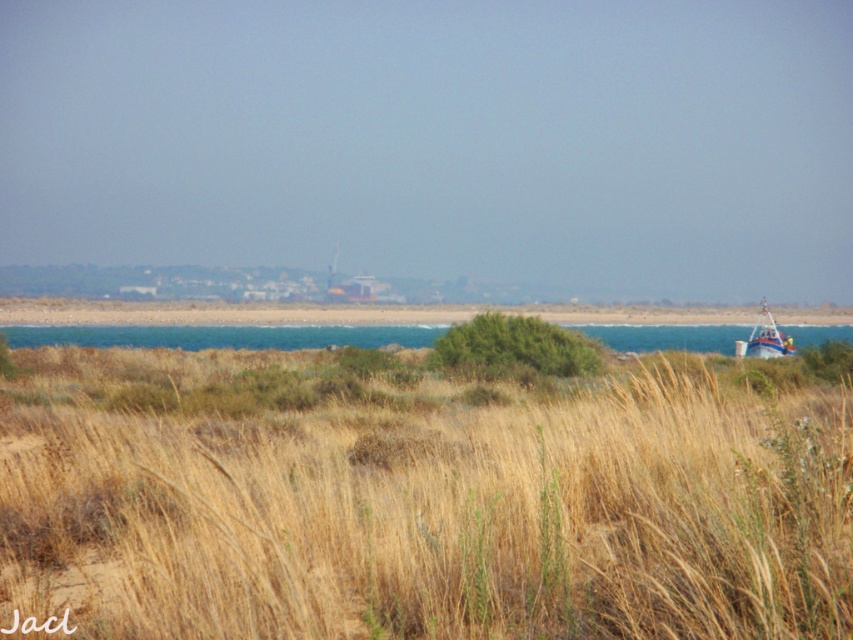
You are a photographer standing in the coastal landscape. You want to capture a photo where the blue water at lower right and the white plastic boat at right are both visible. Which object will occupy more space in the photo?

The blue water at lower right is bigger than the white plastic boat at right, so it will occupy more space in the photo.

You are standing in the coastal landscape and want to walk from the dry grass at center to the white plastic boat at right. Which direction should you move to get closer to the boat?

You should move towards the right direction because the white plastic boat at right is further away from you compared to the dry grass at center, which is closer. To reach the boat, you need to walk towards it on the right side of the scene.